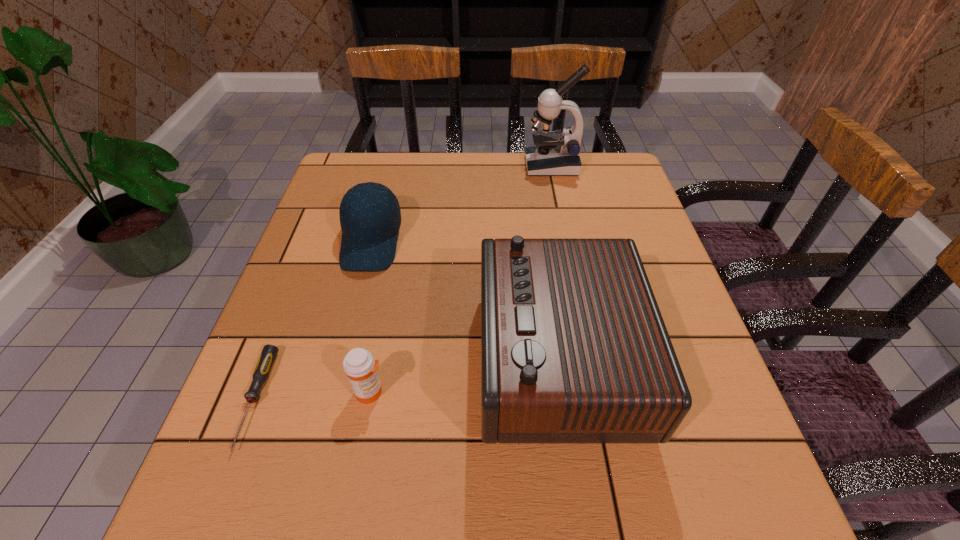
You are a GUI agent. You are given a task and a screenshot of the screen. Output one action in this format:
    pyautogui.click(x=<x>, y=<y>)
    Task: Click on the vacant region between the baseball cap and the medicine
    The width and height of the screenshot is (960, 540).
    Given the screenshot: What is the action you would take?
    371,317

At what (x,y) coordinates should I click in order to perform the action: click on vacant space that's between the radio receiver and the shortest object. Please return your answer as a coordinate pair (x, y). Looking at the image, I should click on (406, 378).

The image size is (960, 540). In order to click on free space between the fourth shortest object and the shortest object in this screenshot , I will do `click(406, 378)`.

Where is `vacant area that lies between the screwdriver and the second shortest object`? This screenshot has height=540, width=960. vacant area that lies between the screwdriver and the second shortest object is located at coordinates (313, 396).

This screenshot has width=960, height=540. I want to click on free space between the screwdriver and the tallest object, so click(403, 282).

The width and height of the screenshot is (960, 540). In order to click on free spot between the fourth nearest object and the leftmost object in this screenshot , I will do `click(314, 321)`.

This screenshot has height=540, width=960. What are the coordinates of `vacant space in between the leftmost object and the baseball cap` in the screenshot? It's located at (314, 321).

Point out which object is positioned as the nearest to the baseball cap. Please provide its 2D coordinates. Your answer should be formatted as a tuple, i.e. [(x, y)], where the tuple contains the x and y coordinates of a point satisfying the conditions above.

[(574, 350)]

Select which object appears as the closest to the medicine. Please provide its 2D coordinates. Your answer should be formatted as a tuple, i.e. [(x, y)], where the tuple contains the x and y coordinates of a point satisfying the conditions above.

[(268, 355)]

You are a GUI agent. You are given a task and a screenshot of the screen. Output one action in this format:
    pyautogui.click(x=<x>, y=<y>)
    Task: Click on the vacant region that satisfies the following two spatial constraints: 1. at the eyepiece of the farthest object; 2. insert the shortest object into a screw head
    
    Given the screenshot: What is the action you would take?
    pyautogui.click(x=600, y=400)